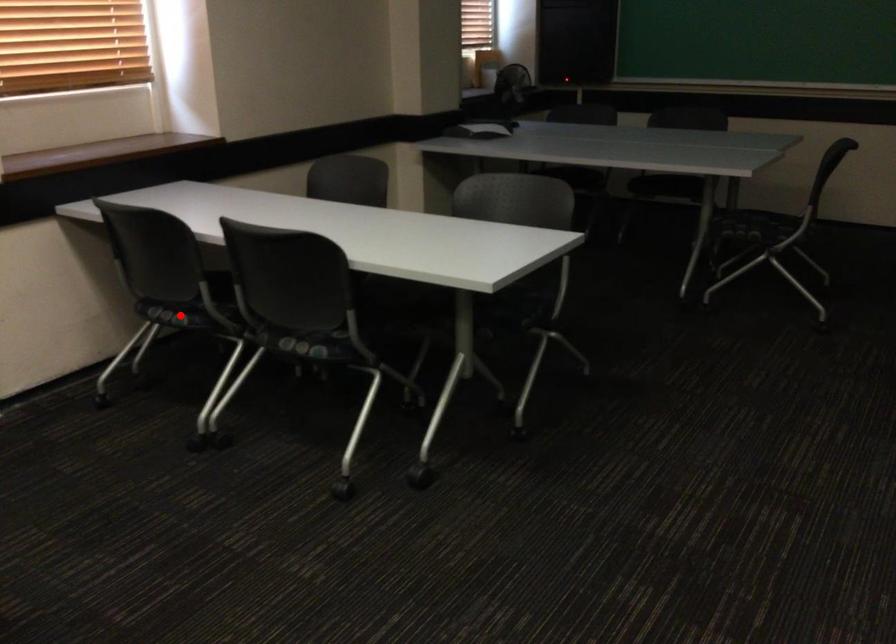
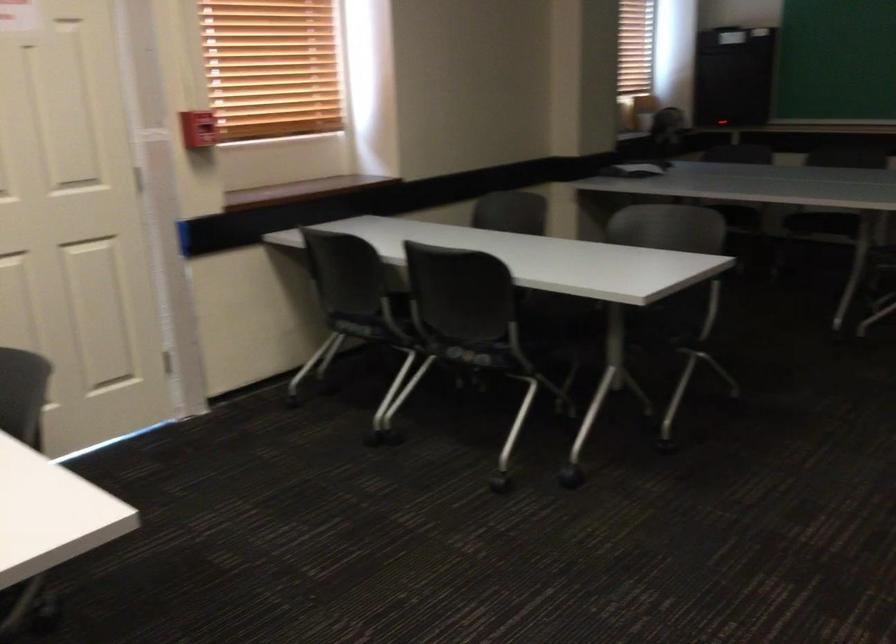
Where in the second image is the point corresponding to the highlighted location from the first image?

(360, 328)